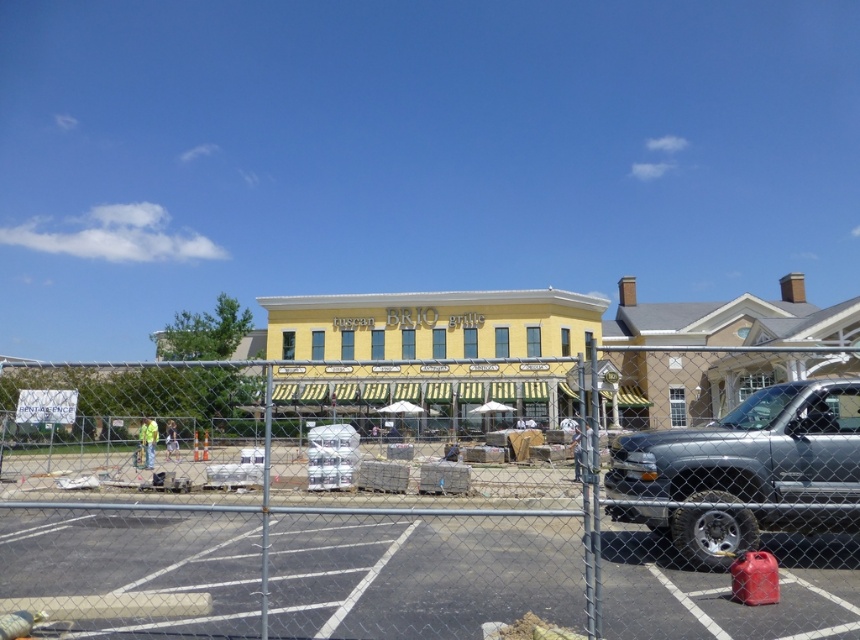
Question: Which point is closer to the camera taking this photo?

Choices:
 (A) (814, 424)
 (B) (624, 624)

Answer: (B)

Question: Can you confirm if chain link fence at center is positioned to the left of silver metallic pickup truck at right?

Choices:
 (A) no
 (B) yes

Answer: (B)

Question: Where is chain link fence at center located in relation to silver metallic pickup truck at right in the image?

Choices:
 (A) above
 (B) below

Answer: (B)

Question: From the image, what is the correct spatial relationship of chain link fence at center in relation to silver metallic pickup truck at right?

Choices:
 (A) right
 (B) left

Answer: (B)